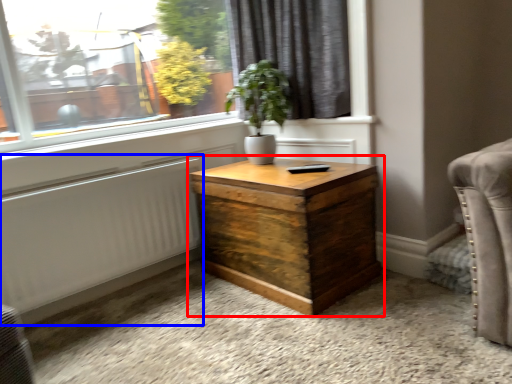
Question: Among these objects, which one is nearest to the camera, nightstand (highlighted by a red box) or radiator (highlighted by a blue box)?

Choices:
 (A) nightstand
 (B) radiator

Answer: (A)